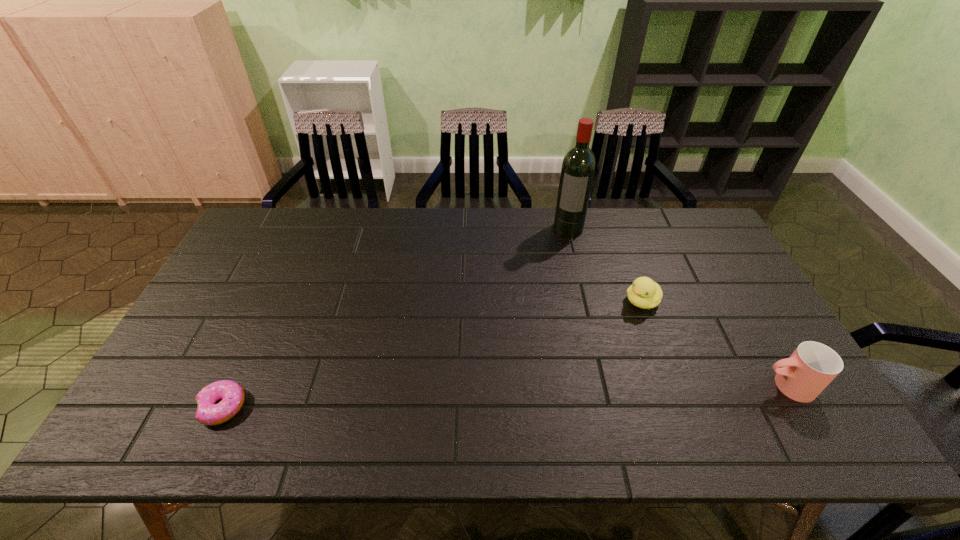
Locate an element on the screen. The height and width of the screenshot is (540, 960). free space between the leftmost object and the farthest object is located at coordinates (396, 318).

Find the location of a particular element. This screenshot has height=540, width=960. free space between the cup and the leftmost object is located at coordinates (505, 396).

The height and width of the screenshot is (540, 960). What are the coordinates of `object that stands as the closest to the second farthest object` in the screenshot? It's located at (809, 370).

At what (x,y) coordinates should I click in order to perform the action: click on object that ranks as the second closest to the shortest object. Please return your answer as a coordinate pair (x, y). The width and height of the screenshot is (960, 540). Looking at the image, I should click on (644, 293).

The height and width of the screenshot is (540, 960). In order to click on vacant region that satisfies the following two spatial constraints: 1. on the back side of the doughnut; 2. on the left side of the farthest object in this screenshot , I will do `click(305, 228)`.

At what (x,y) coordinates should I click in order to perform the action: click on blank space that satisfies the following two spatial constraints: 1. on the front side of the cup; 2. on the side of the second farthest object with the handle. Please return your answer as a coordinate pair (x, y). Looking at the image, I should click on (673, 386).

The width and height of the screenshot is (960, 540). I want to click on free space that satisfies the following two spatial constraints: 1. on the front side of the second farthest object; 2. on the side of the second tallest object with the handle, so click(673, 386).